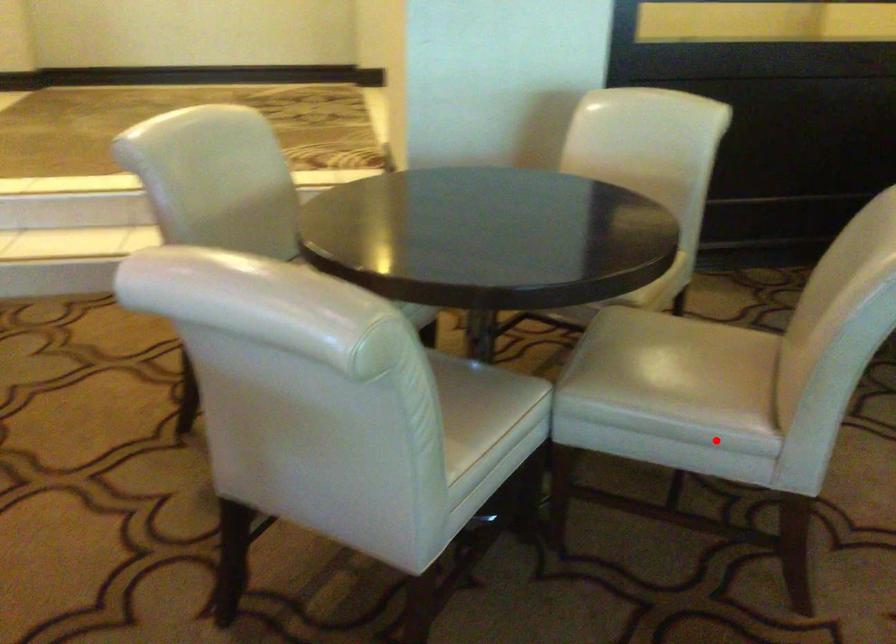
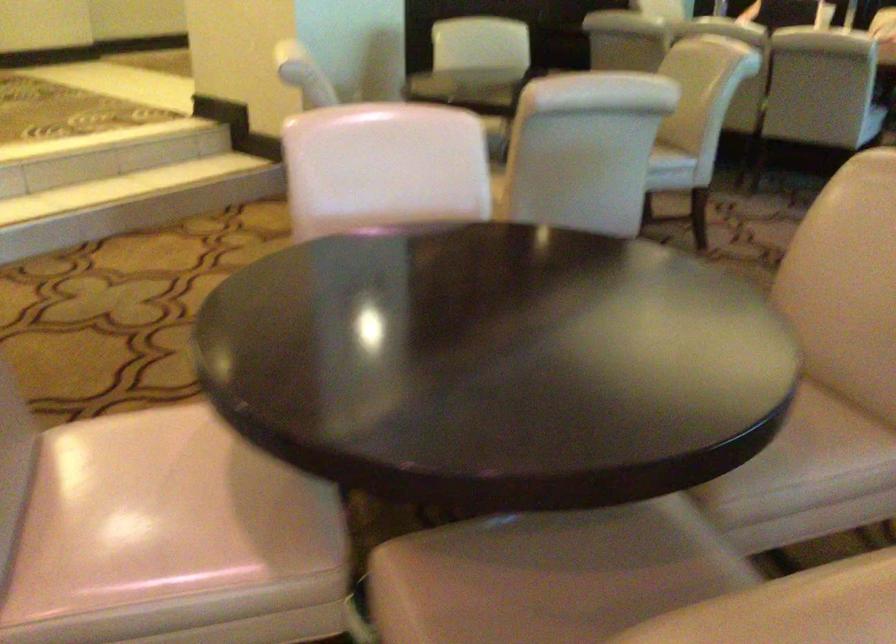
Question: I am providing you with two images of the same scene from different viewpoints. Image1 has a red point marked. In image2, the corresponding 3D location appears at what relative position? Reply with the corresponding letter.

Choices:
 (A) Closer
 (B) Farther

Answer: (B)